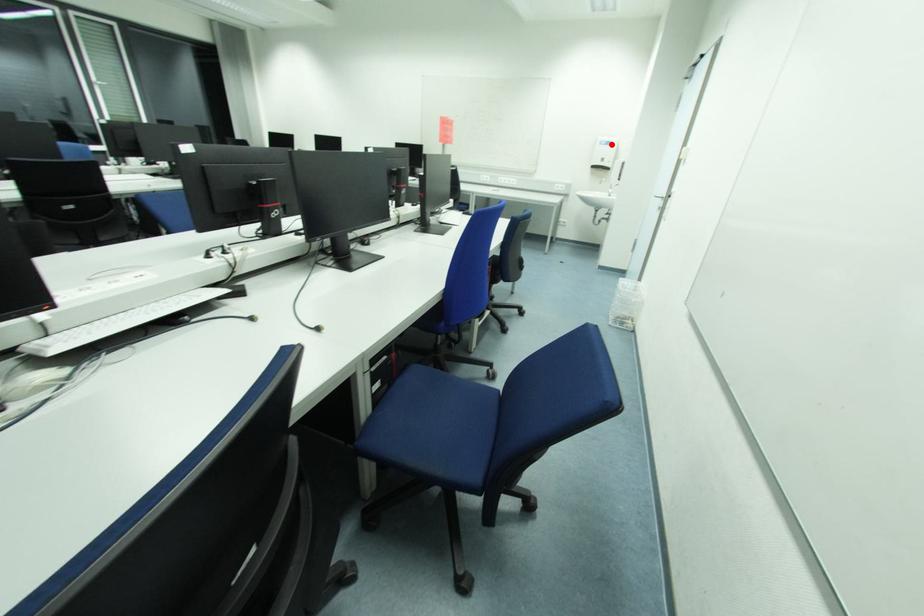
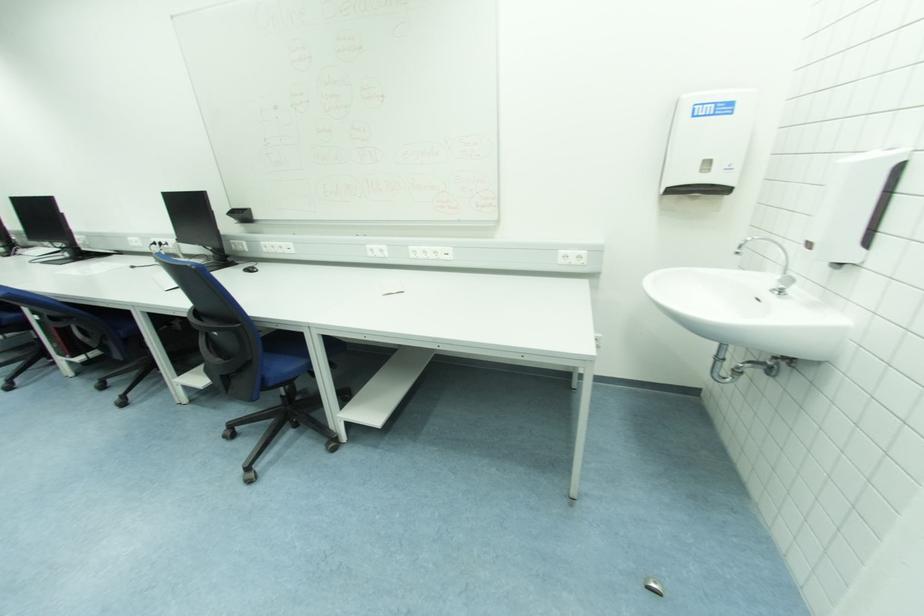
Question: I am providing you with two images of the same scene from different viewpoints. In image1, a red point is highlighted. Considering the same 3D point in image2, which of the following is correct?

Choices:
 (A) It is closer
 (B) It is farther

Answer: (B)